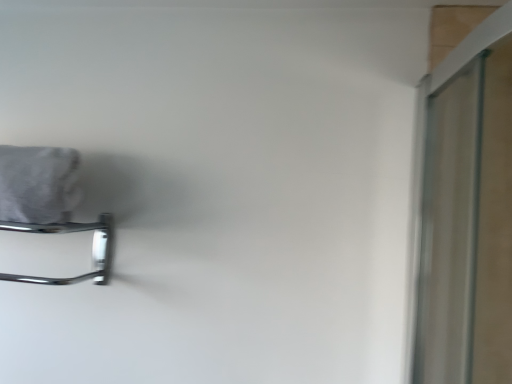
Question: Could you tell me if gray fabric bath towel at upper left is turned towards chrome metallic towel rack at left?

Choices:
 (A) no
 (B) yes

Answer: (A)

Question: Is gray fabric bath towel at upper left wider than chrome metallic towel rack at left?

Choices:
 (A) yes
 (B) no

Answer: (A)

Question: Is gray fabric bath towel at upper left placed right next to chrome metallic towel rack at left?

Choices:
 (A) yes
 (B) no

Answer: (B)

Question: From the image's perspective, does gray fabric bath towel at upper left appear higher than chrome metallic towel rack at left?

Choices:
 (A) yes
 (B) no

Answer: (A)

Question: Considering the relative sizes of gray fabric bath towel at upper left and chrome metallic towel rack at left in the image provided, is gray fabric bath towel at upper left shorter than chrome metallic towel rack at left?

Choices:
 (A) no
 (B) yes

Answer: (A)

Question: Does gray fabric bath towel at upper left appear on the left side of chrome metallic towel rack at left?

Choices:
 (A) yes
 (B) no

Answer: (A)

Question: From a real-world perspective, is chrome metallic towel rack at left on gray fabric bath towel at upper left?

Choices:
 (A) yes
 (B) no

Answer: (B)

Question: Are chrome metallic towel rack at left and gray fabric bath towel at upper left located far from each other?

Choices:
 (A) no
 (B) yes

Answer: (A)

Question: Is chrome metallic towel rack at left aimed at gray fabric bath towel at upper left?

Choices:
 (A) yes
 (B) no

Answer: (B)

Question: Is chrome metallic towel rack at left behind gray fabric bath towel at upper left?

Choices:
 (A) no
 (B) yes

Answer: (B)

Question: From the image's perspective, does chrome metallic towel rack at left appear higher than gray fabric bath towel at upper left?

Choices:
 (A) yes
 (B) no

Answer: (B)

Question: Is chrome metallic towel rack at left to the right of gray fabric bath towel at upper left from the viewer's perspective?

Choices:
 (A) no
 (B) yes

Answer: (B)

Question: From a real-world perspective, relative to chrome metallic towel rack at left, is gray fabric bath towel at upper left vertically above or below?

Choices:
 (A) below
 (B) above

Answer: (B)